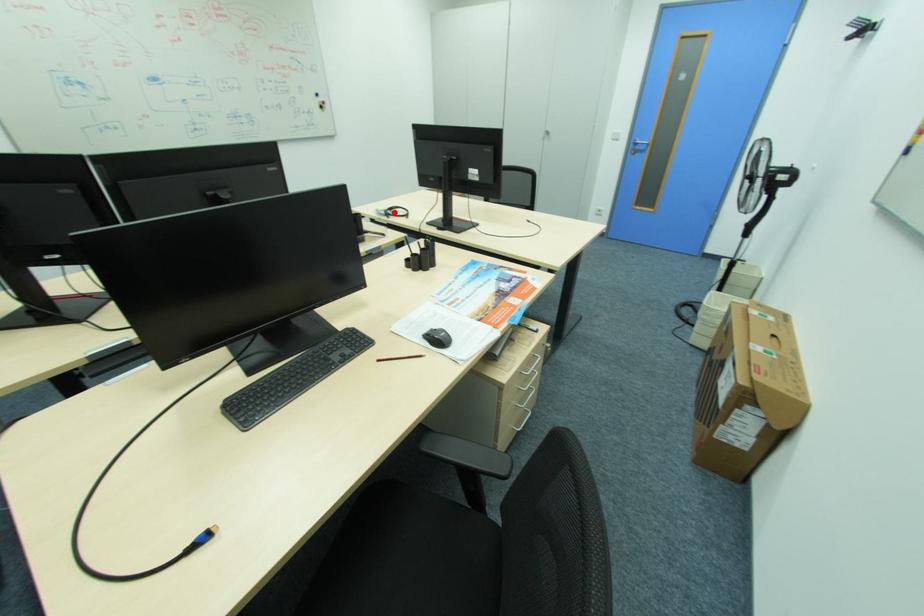
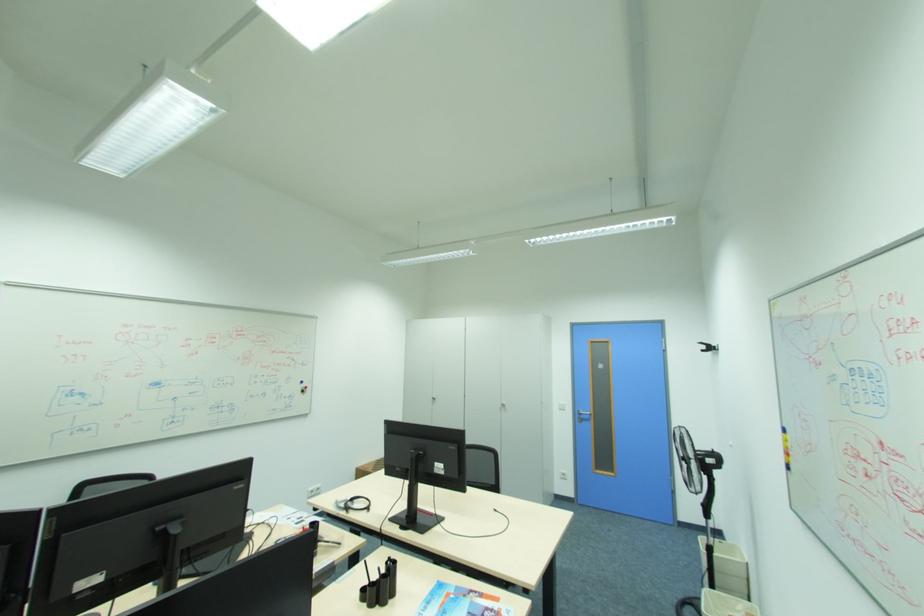
Question: I am providing you with two images of the same scene from different viewpoints. A red point is marked on the first image. Is the red point's position out of view in image 2?

Choices:
 (A) Yes
 (B) No

Answer: (B)